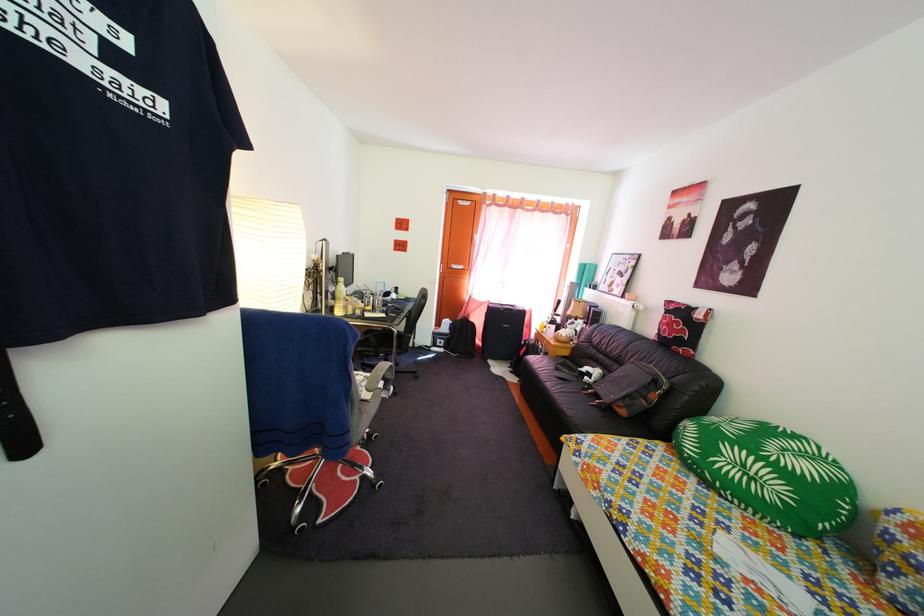
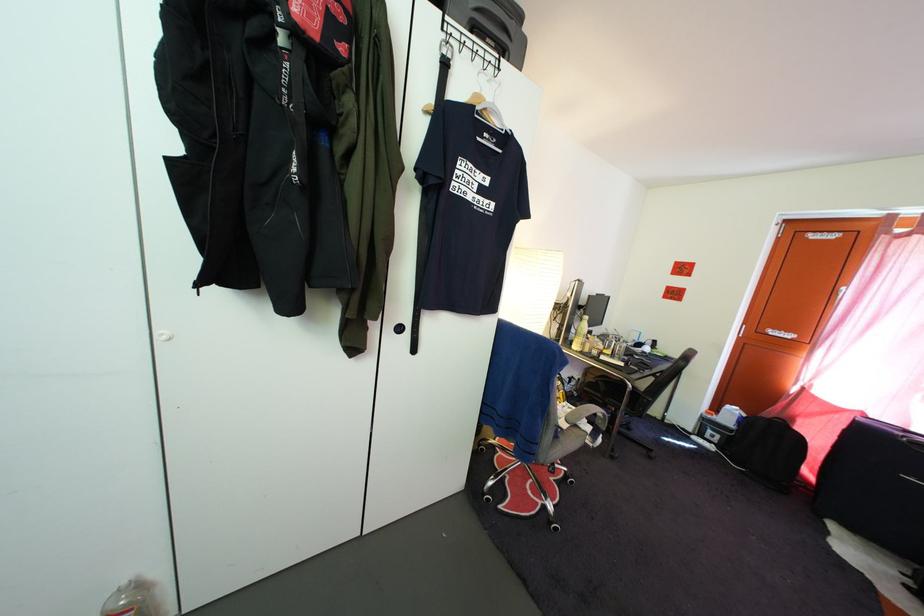
Locate, in the second image, the point that corresponds to (x=378, y=310) in the first image.

(618, 354)